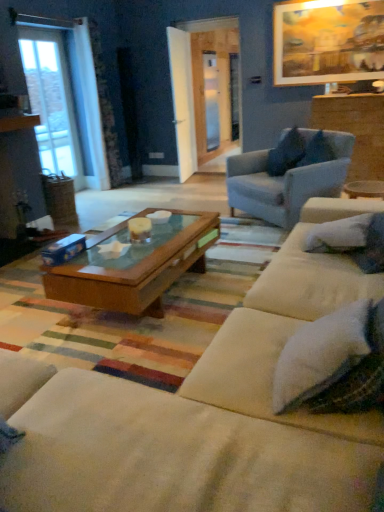
Question: Which direction should I rotate to face clear glass screen door at center, which ranks as the 2th screen door in back-to-front order, — up or down?

Choices:
 (A) up
 (B) down

Answer: (A)

Question: Is clear glass screen door at center, acting as the 1th screen door starting from the front, thinner than white soft pillow at right, the second pillow viewed from the back?

Choices:
 (A) no
 (B) yes

Answer: (B)

Question: Is white soft pillow at right, the third pillow positioned from the top, located within clear glass screen door at center, acting as the 1th screen door starting from the front?

Choices:
 (A) yes
 (B) no

Answer: (B)

Question: Considering the relative sizes of clear glass screen door at center, marked as the first screen door in a left-to-right arrangement, and white soft pillow at right, which ranks as the 2th pillow in front-to-back order, in the image provided, is clear glass screen door at center, marked as the first screen door in a left-to-right arrangement, shorter than white soft pillow at right, which ranks as the 2th pillow in front-to-back order,?

Choices:
 (A) yes
 (B) no

Answer: (B)

Question: Is there a large distance between clear glass screen door at center, which ranks as the 2th screen door in back-to-front order, and white soft pillow at right, the second pillow viewed from the back?

Choices:
 (A) yes
 (B) no

Answer: (A)

Question: Is clear glass screen door at center, marked as the first screen door in a left-to-right arrangement, to the left of white soft pillow at right, the third pillow positioned from the top, from the viewer's perspective?

Choices:
 (A) no
 (B) yes

Answer: (B)

Question: From the image's perspective, would you say clear glass screen door at center, the second screen door from the right, is positioned over white soft pillow at right, which ranks as the 2th pillow in front-to-back order?

Choices:
 (A) no
 (B) yes

Answer: (B)

Question: Is white soft pillow at right, which ranks as the 1th pillow in bottom-to-top order, aimed at wooden picture frame at upper right?

Choices:
 (A) yes
 (B) no

Answer: (B)

Question: Is white soft pillow at right, the third pillow positioned from the top, at the left side of wooden picture frame at upper right?

Choices:
 (A) no
 (B) yes

Answer: (B)

Question: Can we say white soft pillow at right, which ranks as the 1th pillow in bottom-to-top order, lies outside wooden picture frame at upper right?

Choices:
 (A) no
 (B) yes

Answer: (B)

Question: Is white soft pillow at right, the second pillow viewed from the back, positioned behind wooden picture frame at upper right?

Choices:
 (A) no
 (B) yes

Answer: (A)

Question: Would you consider white soft pillow at right, which ranks as the 2th pillow in front-to-back order, to be distant from wooden picture frame at upper right?

Choices:
 (A) no
 (B) yes

Answer: (B)

Question: From the image's perspective, is white soft pillow at right, which ranks as the 2th pillow in front-to-back order, under wooden picture frame at upper right?

Choices:
 (A) no
 (B) yes

Answer: (B)

Question: From the image's perspective, is clear glass screen door at center, acting as the 1th screen door starting from the front, on top of clear glass door at left?

Choices:
 (A) no
 (B) yes

Answer: (B)